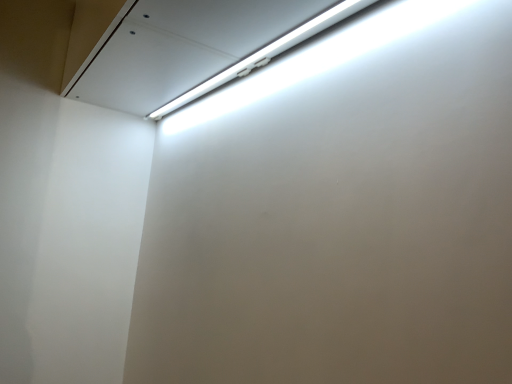
Identify the location of white fluorescent tube at upper center. Image resolution: width=512 pixels, height=384 pixels. (266, 53).

This screenshot has width=512, height=384. What do you see at coordinates (266, 53) in the screenshot?
I see `white fluorescent tube at upper center` at bounding box center [266, 53].

Looking at this image, measure the distance between white fluorescent tube at upper center and camera.

A distance of 33.58 inches exists between white fluorescent tube at upper center and camera.

The width and height of the screenshot is (512, 384). Find the location of `white fluorescent tube at upper center`. white fluorescent tube at upper center is located at coordinates (266, 53).